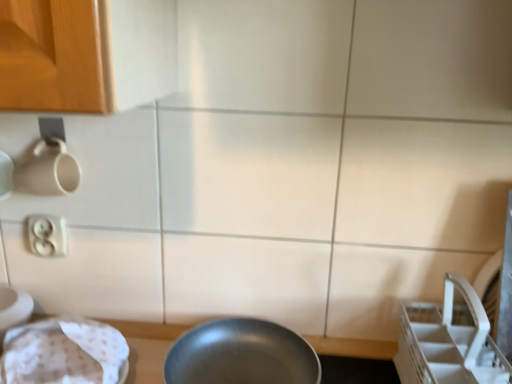
Question: From a real-world perspective, is transparent plastic sink at lower left on top of shiny silver frying pan at center?

Choices:
 (A) no
 (B) yes

Answer: (B)

Question: Considering the relative sizes of transparent plastic sink at lower left and shiny silver frying pan at center in the image provided, is transparent plastic sink at lower left wider than shiny silver frying pan at center?

Choices:
 (A) no
 (B) yes

Answer: (A)

Question: Is transparent plastic sink at lower left outside of shiny silver frying pan at center?

Choices:
 (A) yes
 (B) no

Answer: (A)

Question: Considering the relative positions of transparent plastic sink at lower left and shiny silver frying pan at center in the image provided, is transparent plastic sink at lower left to the left of shiny silver frying pan at center from the viewer's perspective?

Choices:
 (A) no
 (B) yes

Answer: (B)

Question: Can you confirm if transparent plastic sink at lower left is bigger than shiny silver frying pan at center?

Choices:
 (A) yes
 (B) no

Answer: (B)

Question: In terms of height, does white plastic electric outlet at upper left look taller or shorter compared to transparent plastic sink at lower left?

Choices:
 (A) tall
 (B) short

Answer: (B)

Question: Is point (39, 228) closer or farther from the camera than point (3, 297)?

Choices:
 (A) farther
 (B) closer

Answer: (A)

Question: From a real-world perspective, is white plastic electric outlet at upper left above or below transparent plastic sink at lower left?

Choices:
 (A) below
 (B) above

Answer: (B)

Question: Is white plastic electric outlet at upper left inside the boundaries of transparent plastic sink at lower left, or outside?

Choices:
 (A) inside
 (B) outside

Answer: (B)

Question: Looking at their shapes, would you say transparent plastic sink at lower left is wider or thinner than shiny silver frying pan at center?

Choices:
 (A) wide
 (B) thin

Answer: (B)

Question: Is transparent plastic sink at lower left taller or shorter than shiny silver frying pan at center?

Choices:
 (A) tall
 (B) short

Answer: (A)

Question: From a real-world perspective, relative to shiny silver frying pan at center, is transparent plastic sink at lower left vertically above or below?

Choices:
 (A) above
 (B) below

Answer: (A)

Question: From the image's perspective, is transparent plastic sink at lower left located above or below shiny silver frying pan at center?

Choices:
 (A) below
 (B) above

Answer: (B)

Question: From a real-world perspective, is shiny silver frying pan at center positioned above or below transparent plastic sink at lower left?

Choices:
 (A) below
 (B) above

Answer: (A)

Question: Does point (214, 349) appear closer or farther from the camera than point (102, 334)?

Choices:
 (A) closer
 (B) farther

Answer: (B)